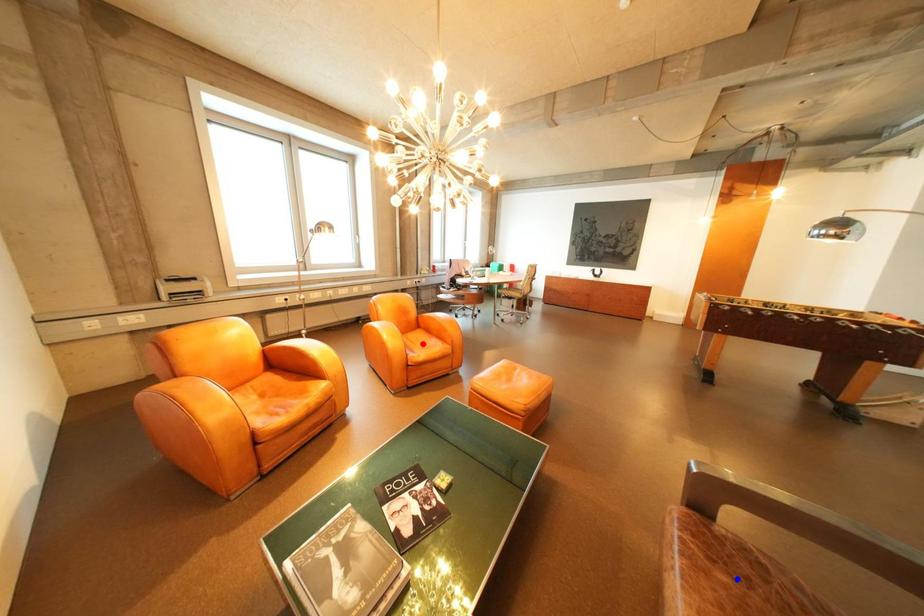
Question: In the image, two points are highlighted. Which point is nearer to the camera? Reply with the corresponding letter.

Choices:
 (A) blue point
 (B) red point

Answer: (A)